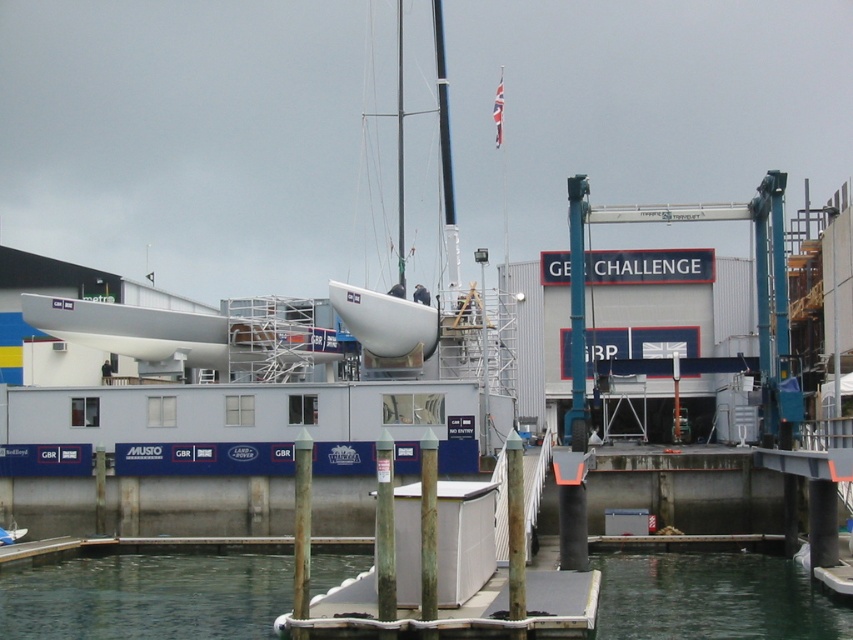
Question: Among these objects, which one is farthest from the camera?

Choices:
 (A) clear water at dock center
 (B) white matte boat at center

Answer: (B)

Question: Is clear water at dock center thinner than white matte boat at center?

Choices:
 (A) no
 (B) yes

Answer: (A)

Question: Is clear water at dock center to the right of white matte boat at center from the viewer's perspective?

Choices:
 (A) yes
 (B) no

Answer: (A)

Question: Does clear water at dock center have a larger size compared to white matte boat at center?

Choices:
 (A) no
 (B) yes

Answer: (A)